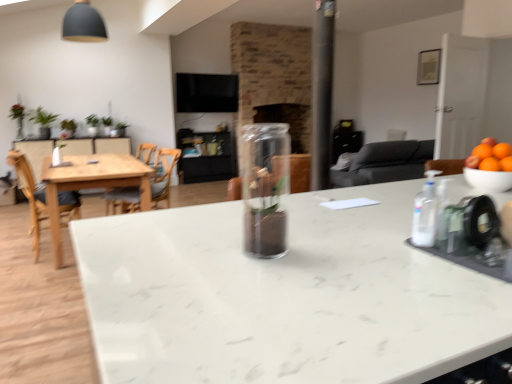
The height and width of the screenshot is (384, 512). I want to click on vacant area that is in front of transparent glass vase at center, so click(264, 273).